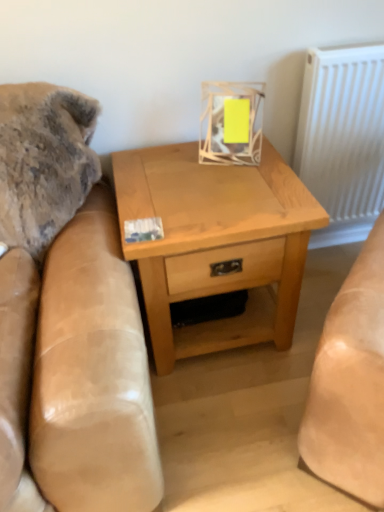
Question: From the image's perspective, does light wood/texture nightstand at center appear higher than white textured radiator at upper right?

Choices:
 (A) yes
 (B) no

Answer: (B)

Question: Is light wood/texture nightstand at center placed right next to white textured radiator at upper right?

Choices:
 (A) no
 (B) yes

Answer: (A)

Question: Considering the relative sizes of light wood/texture nightstand at center and white textured radiator at upper right in the image provided, is light wood/texture nightstand at center wider than white textured radiator at upper right?

Choices:
 (A) no
 (B) yes

Answer: (B)

Question: Is light wood/texture nightstand at center oriented towards white textured radiator at upper right?

Choices:
 (A) yes
 (B) no

Answer: (B)

Question: Does light wood/texture nightstand at center have a larger size compared to white textured radiator at upper right?

Choices:
 (A) yes
 (B) no

Answer: (A)

Question: From a real-world perspective, is light wood/texture nightstand at center over white textured radiator at upper right?

Choices:
 (A) no
 (B) yes

Answer: (A)

Question: Can you confirm if white textured radiator at upper right is shorter than light wood/texture nightstand at center?

Choices:
 (A) no
 (B) yes

Answer: (A)

Question: Is white textured radiator at upper right wider than light wood/texture nightstand at center?

Choices:
 (A) no
 (B) yes

Answer: (A)

Question: From a real-world perspective, is white textured radiator at upper right under light wood/texture nightstand at center?

Choices:
 (A) no
 (B) yes

Answer: (A)

Question: Considering the relative sizes of white textured radiator at upper right and light wood/texture nightstand at center in the image provided, is white textured radiator at upper right smaller than light wood/texture nightstand at center?

Choices:
 (A) yes
 (B) no

Answer: (A)

Question: Is white textured radiator at upper right at the right side of light wood/texture nightstand at center?

Choices:
 (A) yes
 (B) no

Answer: (A)

Question: From the image's perspective, is white textured radiator at upper right below light wood/texture nightstand at center?

Choices:
 (A) no
 (B) yes

Answer: (A)

Question: Is light wood/texture nightstand at center wider or thinner than white textured radiator at upper right?

Choices:
 (A) thin
 (B) wide

Answer: (B)